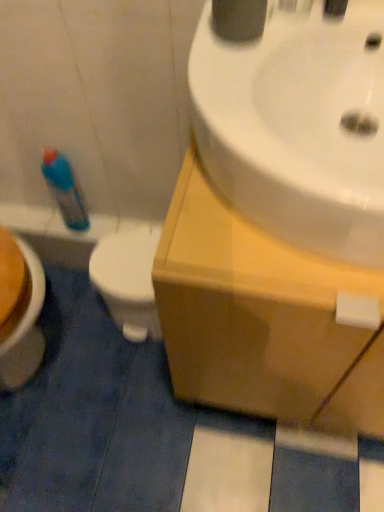
Question: Should I look upward or downward to see white glossy toilet at lower left?

Choices:
 (A) up
 (B) down

Answer: (B)

Question: Considering the relative sizes of white glossy sink at upper right and white glossy toilet at lower left in the image provided, is white glossy sink at upper right shorter than white glossy toilet at lower left?

Choices:
 (A) yes
 (B) no

Answer: (A)

Question: Does white glossy sink at upper right turn towards white glossy toilet at lower left?

Choices:
 (A) yes
 (B) no

Answer: (B)

Question: Does white glossy sink at upper right have a greater height compared to white glossy toilet at lower left?

Choices:
 (A) yes
 (B) no

Answer: (B)

Question: Is white glossy sink at upper right surrounding white glossy toilet at lower left?

Choices:
 (A) no
 (B) yes

Answer: (A)

Question: Is white glossy sink at upper right not close to white glossy toilet at lower left?

Choices:
 (A) no
 (B) yes

Answer: (A)

Question: Does white glossy sink at upper right come behind white glossy toilet at lower left?

Choices:
 (A) no
 (B) yes

Answer: (A)

Question: Can you confirm if wooden cabinet at upper right is smaller than blue plastic spray bottle at left?

Choices:
 (A) yes
 (B) no

Answer: (B)

Question: Would you say wooden cabinet at upper right is a long distance from blue plastic spray bottle at left?

Choices:
 (A) yes
 (B) no

Answer: (B)

Question: Considering the relative sizes of wooden cabinet at upper right and blue plastic spray bottle at left in the image provided, is wooden cabinet at upper right shorter than blue plastic spray bottle at left?

Choices:
 (A) no
 (B) yes

Answer: (A)

Question: From the image's perspective, is wooden cabinet at upper right on blue plastic spray bottle at left?

Choices:
 (A) no
 (B) yes

Answer: (A)

Question: Is the depth of wooden cabinet at upper right less than that of blue plastic spray bottle at left?

Choices:
 (A) yes
 (B) no

Answer: (A)

Question: Is wooden cabinet at upper right positioned beyond the bounds of blue plastic spray bottle at left?

Choices:
 (A) yes
 (B) no

Answer: (A)

Question: Is wooden cabinet at upper right completely or partially outside of white glossy sink at upper right?

Choices:
 (A) no
 (B) yes

Answer: (B)